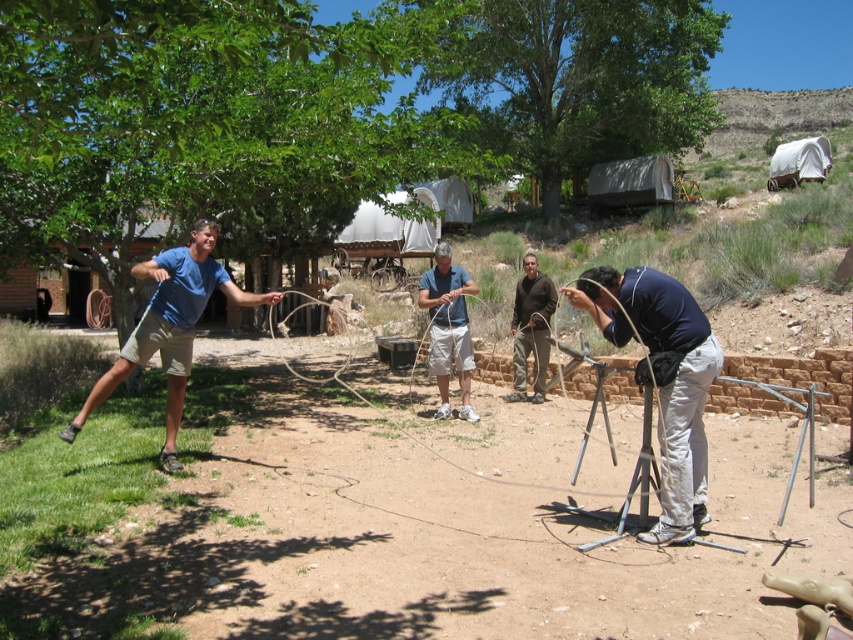
You are a photographer trying to capture a clear shot of both the blue cotton shirt at left and the matte blue shirt at center. Based on their positions, which one might be easier to see in the photo?

The blue cotton shirt at left is in front of the matte blue shirt at center, so it will be easier to see in the photo because it is closer to the camera.

You are standing at the point marked as point (157,310) and want to walk towards the group of four people in the scene. Can you estimate how far you need to walk to reach them?

The distance between point (157,310) and the viewer is 6.55 meters, so you need to walk approximately 6.55 meters to reach the group of four people.

You are a participant in the rope activity and need to determine the relative height of the dark blue fabric at center and the blue cotton shirt at left. Which one is shorter?

The dark blue fabric at center is shorter than the blue cotton shirt at left.